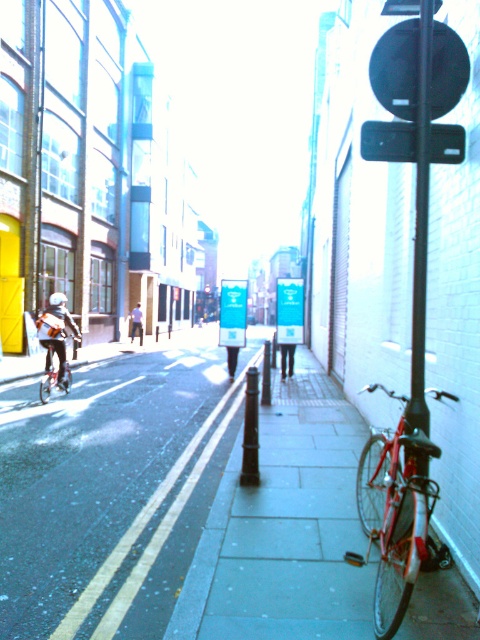
Does smooth concrete pavement at center have a greater height compared to matte black helmet at upper left?

Indeed, smooth concrete pavement at center has a greater height compared to matte black helmet at upper left.

Find the location of `smooth concrete pavement at center`. smooth concrete pavement at center is located at coordinates (285, 528).

This screenshot has width=480, height=640. Find the location of `smooth concrete pavement at center`. smooth concrete pavement at center is located at coordinates (285, 528).

From the picture: Who is more distant from viewer, (199, 586) or (142, 323)?

The point (142, 323) is more distant.

Is smooth concrete pavement at center to the left of light blue shirt at center from the viewer's perspective?

Incorrect, smooth concrete pavement at center is not on the left side of light blue shirt at center.

Where is `smooth concrete pavement at center`? smooth concrete pavement at center is located at coordinates click(x=285, y=528).

Which is in front, point (396, 442) or point (46, 324)?

Point (396, 442)

Is shiny red bicycle at right shorter than matte black helmet at upper left?

Incorrect, shiny red bicycle at right's height does not fall short of matte black helmet at upper left's.

At what (x,y) coordinates should I click in order to perform the action: click on shiny red bicycle at right. Please return your answer as a coordinate pair (x, y). This screenshot has height=640, width=480. Looking at the image, I should click on (395, 515).